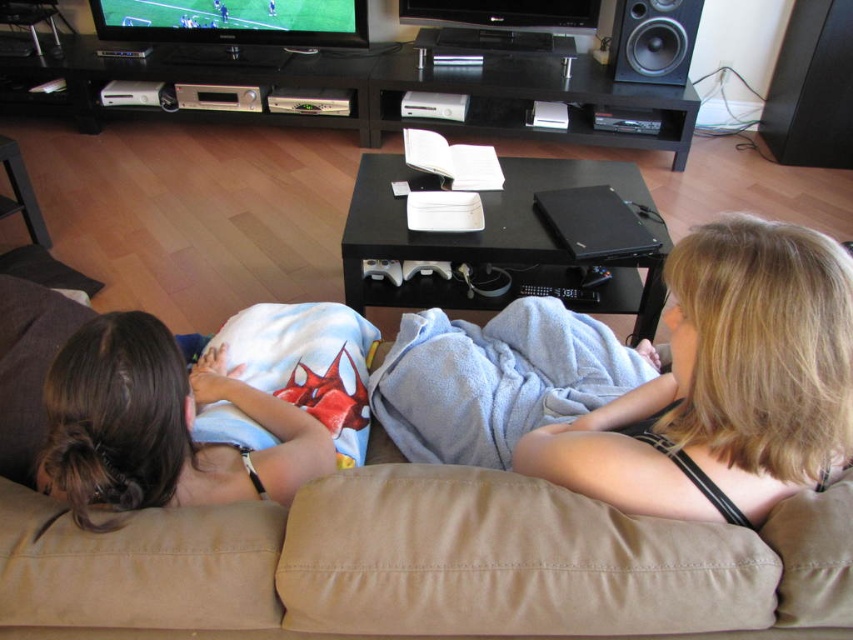
You are a visitor arriving at the living room and want to sit as close as possible to the TV. Which object should you choose between the brown fabric couch at center and the black matte speaker at upper right?

The brown fabric couch at center is positioned on the left side of black matte speaker at upper right, so the brown fabric couch at center is closer to the TV than the black matte speaker at upper right. Therefore, you should choose the brown fabric couch at center to sit closer to the TV.

You are a visitor entering the living room and want to grab the light blue fabric blanket at left to cover yourself. Considering your arm length is 28 inches, can you reach it without moving from your current position?

The light blue fabric blanket at left is 35.08 inches from viewer, which is farther than your 28 inches arm length. You cannot reach it without moving.

You are a delivery person who needs to place a package on top of the brown fabric couch at center and the black matte speaker at upper right. Which surface will allow the package to be more visible from the doorway?

The brown fabric couch at center has a greater height compared to the black matte speaker at upper right, so placing the package on the brown fabric couch at center will make it more visible from the doorway.